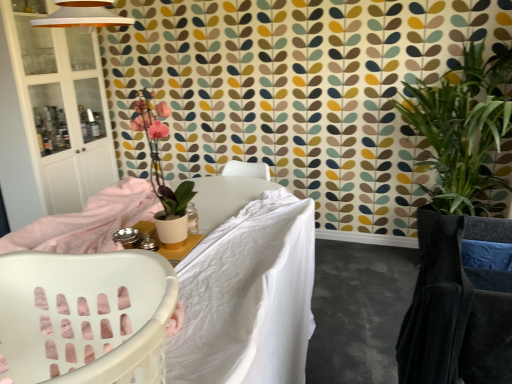
Question: Which is correct: matte white table at center is inside matte white pot at upper left, which is the second houseplant in right-to-left order, or outside of it?

Choices:
 (A) outside
 (B) inside

Answer: (A)

Question: Considering the positions of matte white table at center and matte white pot at upper left, marked as the 1th houseplant in a left-to-right arrangement, in the image, is matte white table at center taller or shorter than matte white pot at upper left, marked as the 1th houseplant in a left-to-right arrangement,?

Choices:
 (A) short
 (B) tall

Answer: (A)

Question: Estimate the real-world distances between objects in this image. Which object is farther from the matte white pot at upper left, arranged as the second houseplant when viewed from the back?

Choices:
 (A) green leafy plant at right, which appears as the first houseplant when viewed from the right
 (B) white plastic laundry basket at left
 (C) white fabric bed at center
 (D) white soft fabric at center
 (E) matte white table at center

Answer: (B)

Question: Which is farther from the white soft fabric at center?

Choices:
 (A) velvet dark grey rocking chair at right
 (B) white glass cabinet at left
 (C) white plastic laundry basket at left
 (D) white fabric bed at center
 (E) matte white pot at upper left, arranged as the second houseplant when viewed from the back

Answer: (E)